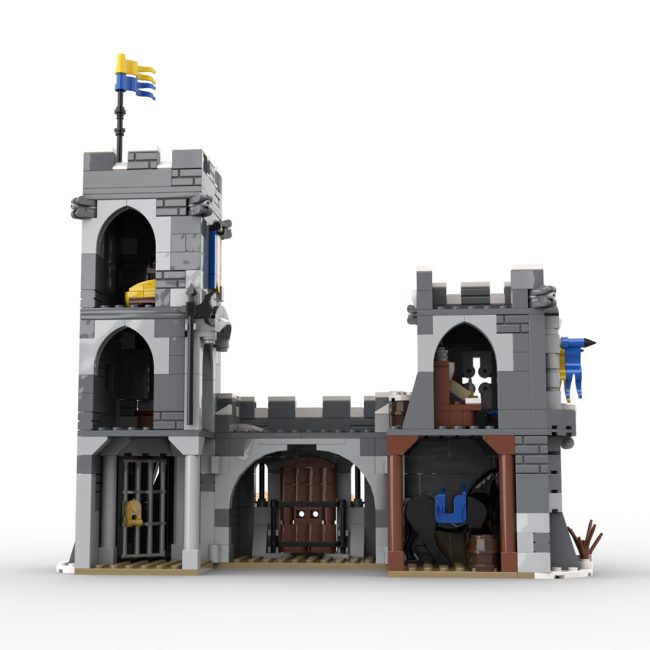
The image size is (650, 650). In order to click on support columns in this screenshot , I will do `click(396, 494)`, `click(506, 487)`.